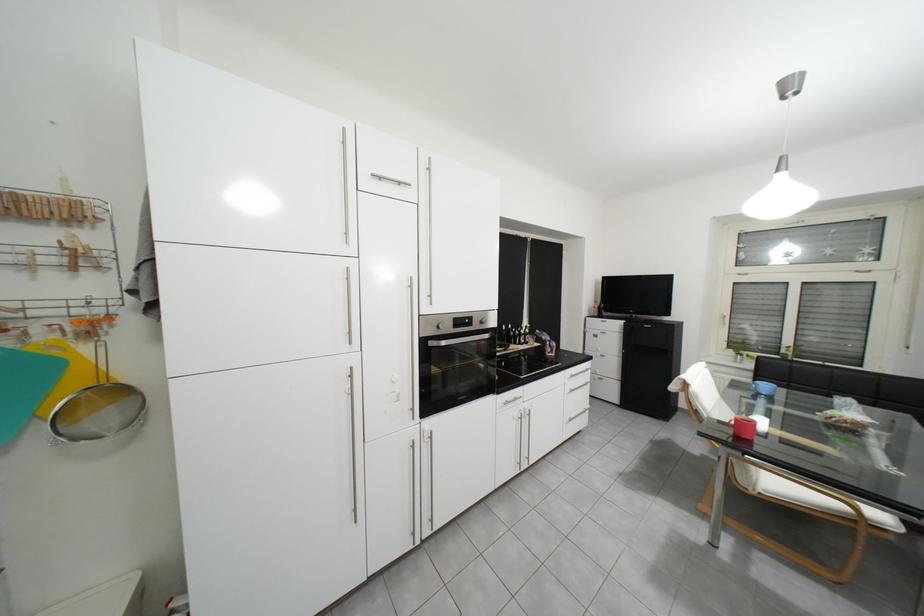
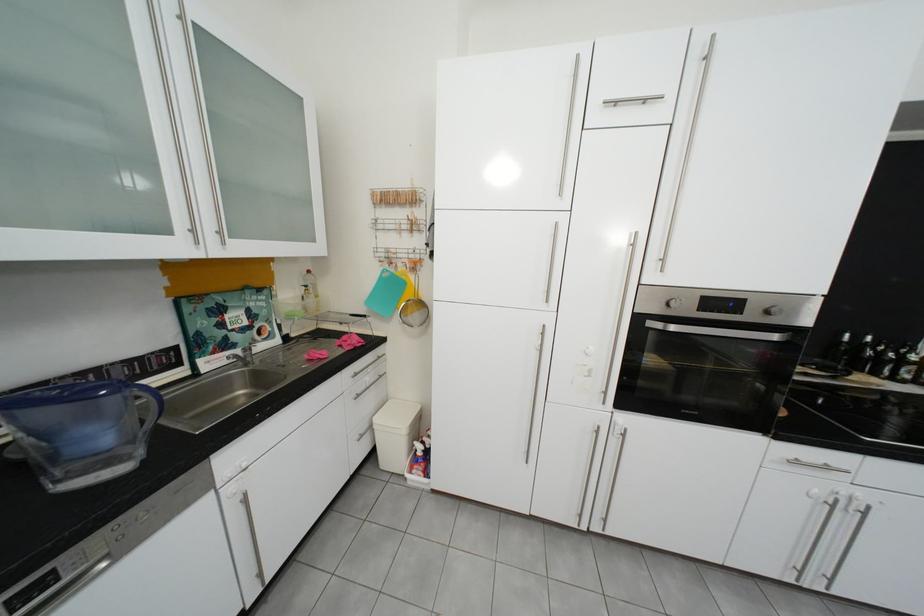
In the second image, find the point that corresponds to (x=32, y=251) in the first image.

(408, 223)